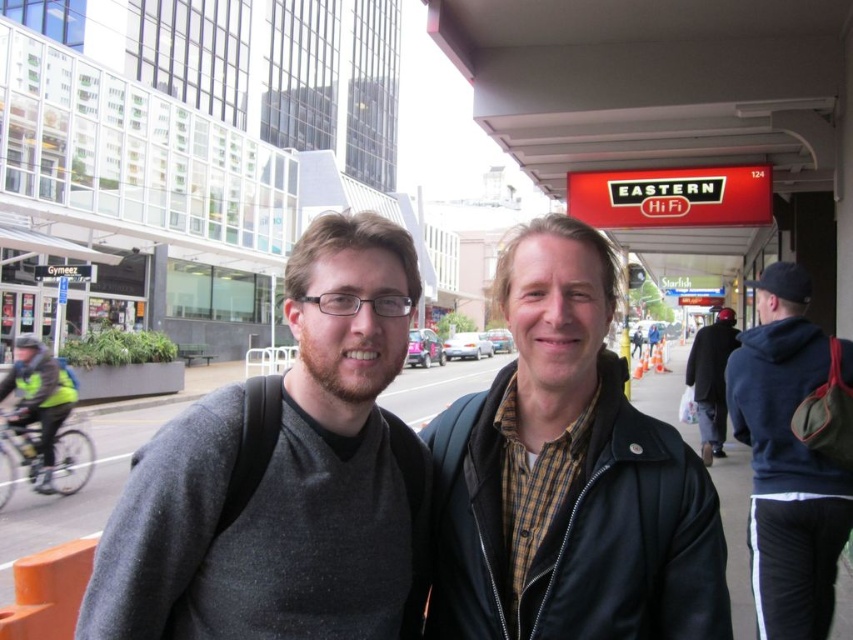
You are a photographer trying to capture a photo of the navy blue hoodie at right and the gray asphalt at center. From the perspective of the two people in the foreground, which object is located to the right?

The navy blue hoodie at right is positioned on the right side of gray asphalt at center, so from the perspective of the two people in the foreground, the navy blue hoodie at right is located to the right.

You are a photographer trying to capture a group photo of the dark gray sweater at center and the navy blue hoodie at right. The camera you are using has a maximum focus range of 3 meters. Can you fit both subjects within the frame without moving the camera?

The dark gray sweater at center and navy blue hoodie at right are 2.91 meters apart, so yes, the camera can focus on both subjects since the distance between them is within the 3 meter range.